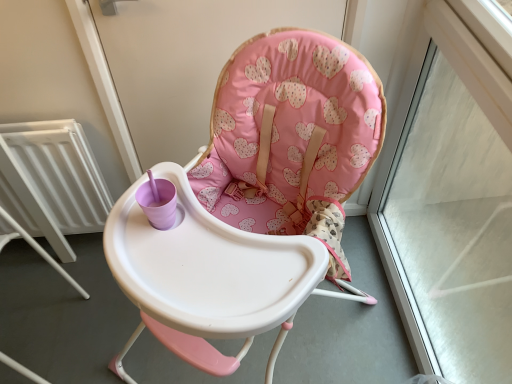
Locate an element on the screen. free location in front of white metallic radiator at left is located at coordinates click(x=72, y=288).